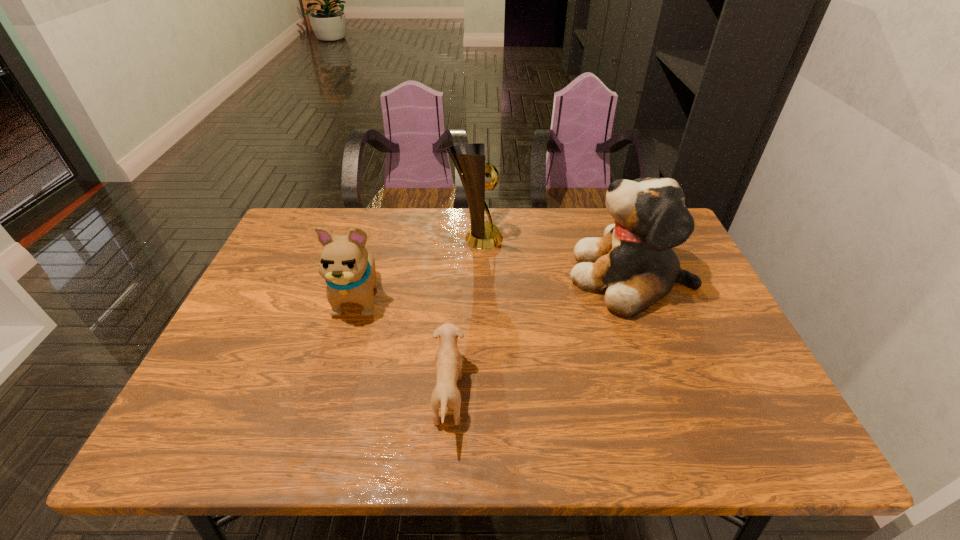
At what (x,y) coordinates should I click in order to perform the action: click on free space that satisfies the following two spatial constraints: 1. at the face of the rightmost puppy; 2. on the face of the leftmost object. Please return your answer as a coordinate pair (x, y). This screenshot has height=540, width=960. Looking at the image, I should click on (638, 296).

The height and width of the screenshot is (540, 960). What are the coordinates of `free spot that satisfies the following two spatial constraints: 1. at the front of the award, where the globe is visible; 2. on the face of the second tallest puppy` in the screenshot? It's located at (476, 296).

In order to click on free location that satisfies the following two spatial constraints: 1. at the front of the award, where the globe is visible; 2. on the face of the leftmost object in this screenshot , I will do `click(476, 296)`.